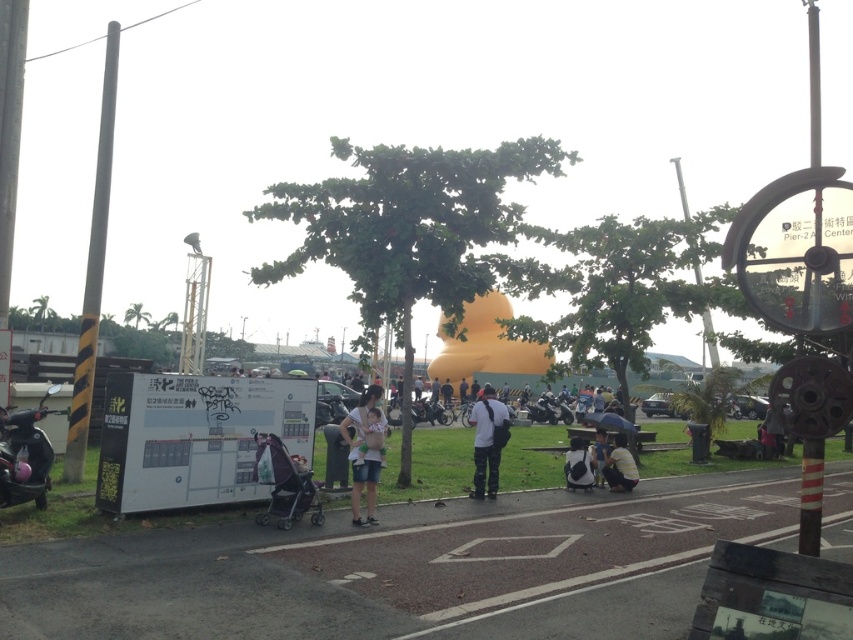
Question: Among these points, which one is nearest to the camera?

Choices:
 (A) (599, 428)
 (B) (451, 388)
 (C) (772, 426)

Answer: (A)

Question: Considering the relative positions of dark blue jeans at center and yellow shirt at lower center in the image provided, where is dark blue jeans at center located with respect to yellow shirt at lower center?

Choices:
 (A) left
 (B) right

Answer: (A)

Question: Can you confirm if yellow shirt at lower center is wider than matte white shirt at center?

Choices:
 (A) no
 (B) yes

Answer: (B)

Question: Estimate the real-world distances between objects in this image. Which object is farther from the dark blue jeans at center?

Choices:
 (A) matte black scooter at left
 (B) dark gray fabric umbrella at center
 (C) silver metallic stroller at lower left
 (D) light blue denim shorts at center

Answer: (B)

Question: Which of these objects is positioned farthest from the light blue denim shorts at center?

Choices:
 (A) matte black scooter at left
 (B) dark gray fabric umbrella at center
 (C) yellow shirt at lower center
 (D) white and black backpack at center

Answer: (A)

Question: Can you confirm if silver metallic stroller at lower left is thinner than light blue denim shorts at center?

Choices:
 (A) no
 (B) yes

Answer: (A)